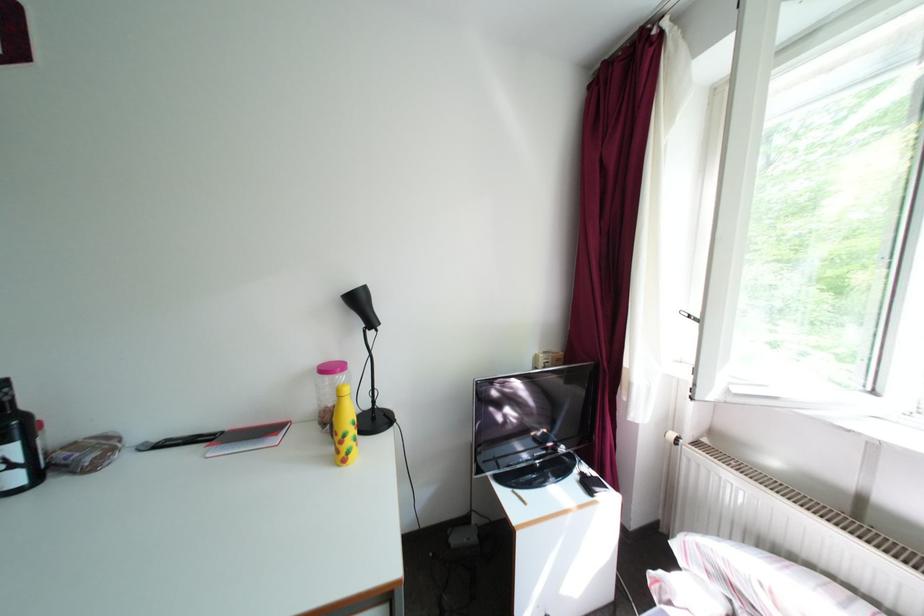
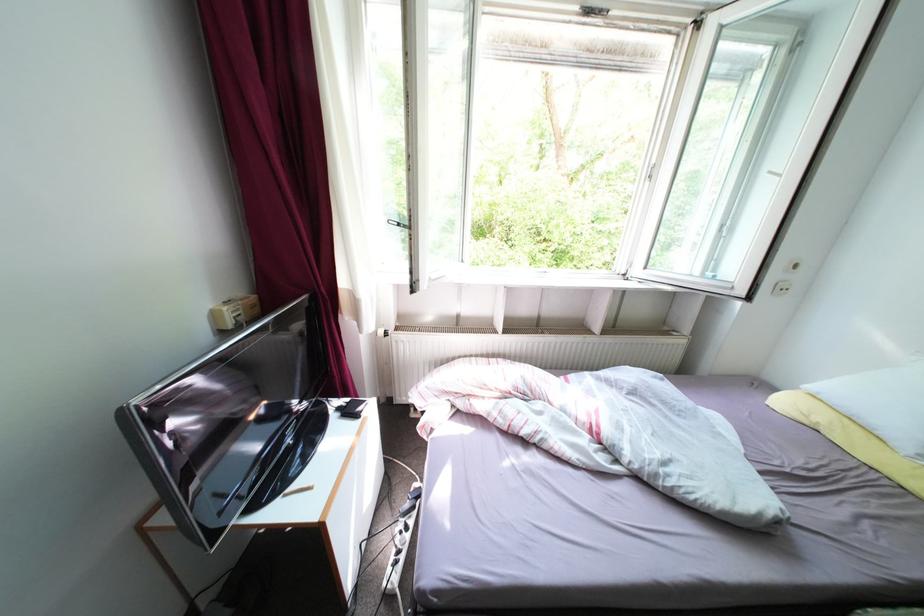
The first image is from the beginning of the video and the second image is from the end. How did the camera likely rotate when shooting the video?

The camera rotated toward right-down.